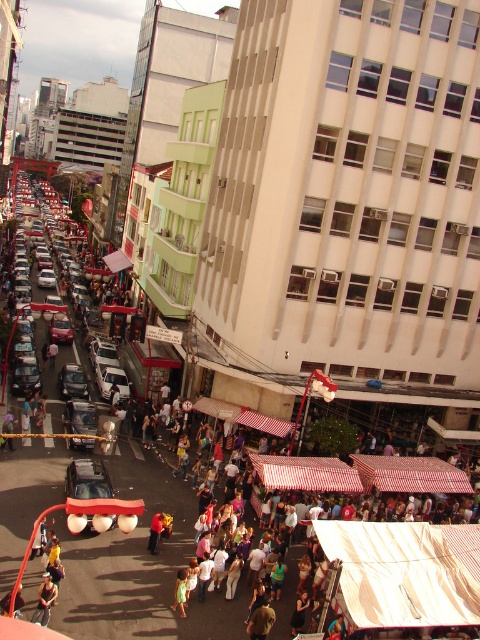
You are a delivery driver who needs to park your metallic silver car at center near the striped fabric market stall at center. Considering the height difference between the two, will your car fit under the stall without any issues?

Answer: The striped fabric market stall at center is taller than the metallic silver car at center, so the metallic silver car at center will fit under the stall without any issues.

From the picture: You are standing at the point marked by the coordinates point [400,564] in the image. Looking around, what is the most prominent object or structure directly in front of you?

The most prominent object directly in front of you is the striped fabric market stall at center, as the coordinates point [400,564] correspond to its location.